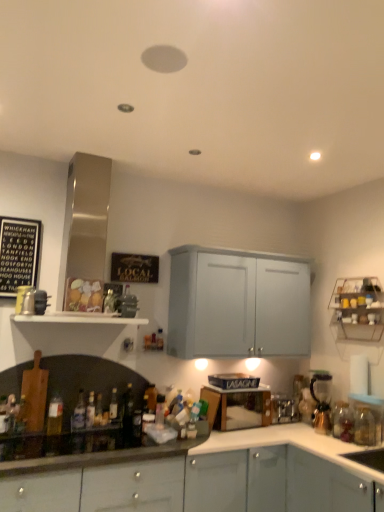
Question: Is translucent glass bottle at lower left, the fourth bottle viewed from the right, not close to translucent glass bottle at lower center, the second bottle viewed from the right?

Choices:
 (A) no
 (B) yes

Answer: (A)

Question: Considering the relative sizes of translucent glass bottle at lower left, the fourth bottle viewed from the right, and translucent glass bottle at lower center, the second bottle viewed from the right, in the image provided, is translucent glass bottle at lower left, the fourth bottle viewed from the right, thinner than translucent glass bottle at lower center, the second bottle viewed from the right,?

Choices:
 (A) yes
 (B) no

Answer: (A)

Question: Is translucent glass bottle at lower center, the second bottle viewed from the right, inside translucent glass bottle at lower left, the fourth bottle viewed from the right?

Choices:
 (A) yes
 (B) no

Answer: (B)

Question: Is translucent glass bottle at lower left, which is the seventh bottle in left-to-right order, beside translucent glass bottle at lower center, the second bottle viewed from the right?

Choices:
 (A) yes
 (B) no

Answer: (B)

Question: From the image's perspective, is translucent glass bottle at lower left, which is the seventh bottle in left-to-right order, beneath translucent glass bottle at lower center, the second bottle viewed from the right?

Choices:
 (A) yes
 (B) no

Answer: (A)

Question: Is translucent glass bottle at lower center, the 9th bottle viewed from the left, situated inside white matte shelf at center, which is counted as the second shelf, starting from the right, or outside?

Choices:
 (A) inside
 (B) outside

Answer: (B)

Question: Looking at their shapes, would you say translucent glass bottle at lower center, the second bottle viewed from the right, is wider or thinner than white matte shelf at center, which is counted as the second shelf, starting from the right?

Choices:
 (A) wide
 (B) thin

Answer: (B)

Question: Relative to white matte shelf at center, the first shelf when ordered from left to right, is translucent glass bottle at lower center, the 9th bottle viewed from the left, in front or behind?

Choices:
 (A) behind
 (B) front

Answer: (A)

Question: Is translucent glass bottle at lower center, the second bottle viewed from the right, taller or shorter than white matte shelf at center, the first shelf when ordered from left to right?

Choices:
 (A) short
 (B) tall

Answer: (B)

Question: Do you think translucent glass bottle at left, which appears as the 9th bottle when viewed from the right, is within translucent glass bottle at lower left, the 6th bottle from the right, or outside of it?

Choices:
 (A) inside
 (B) outside

Answer: (B)

Question: From the image's perspective, relative to translucent glass bottle at lower left, the 6th bottle from the right, is translucent glass bottle at left, which appears as the 9th bottle when viewed from the right, above or below?

Choices:
 (A) above
 (B) below

Answer: (A)

Question: In terms of width, does translucent glass bottle at left, the 2th bottle positioned from the left, look wider or thinner when compared to translucent glass bottle at lower left, the 6th bottle from the right?

Choices:
 (A) thin
 (B) wide

Answer: (A)

Question: Is translucent glass bottle at left, which appears as the 9th bottle when viewed from the right, in front of or behind translucent glass bottle at lower left, the 5th bottle from the left, in the image?

Choices:
 (A) front
 (B) behind

Answer: (A)

Question: In terms of size, does metallic wire rack at upper right, arranged as the first shelf when viewed from the right, appear bigger or smaller than translucent glass bottle at lower left, the third bottle when ordered from left to right?

Choices:
 (A) big
 (B) small

Answer: (A)

Question: From the image's perspective, is metallic wire rack at upper right, arranged as the first shelf when viewed from the right, located above or below translucent glass bottle at lower left, the third bottle when ordered from left to right?

Choices:
 (A) above
 (B) below

Answer: (A)